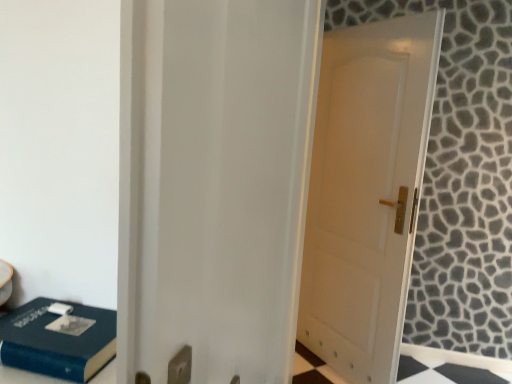
Question: Does blue matte book at lower left turn towards white matte door at center?

Choices:
 (A) no
 (B) yes

Answer: (A)

Question: Does blue matte book at lower left have a larger size compared to white matte door at center?

Choices:
 (A) no
 (B) yes

Answer: (A)

Question: From a real-world perspective, is blue matte book at lower left over white matte door at center?

Choices:
 (A) yes
 (B) no

Answer: (B)

Question: Is white matte door at center located within blue matte book at lower left?

Choices:
 (A) yes
 (B) no

Answer: (B)

Question: From the image's perspective, does blue matte book at lower left appear higher than white matte door at center?

Choices:
 (A) no
 (B) yes

Answer: (A)

Question: Is white matte door at center taller or shorter than blue matte book at lower left?

Choices:
 (A) tall
 (B) short

Answer: (A)

Question: Would you say white matte door at center is to the left or to the right of blue matte book at lower left in the picture?

Choices:
 (A) left
 (B) right

Answer: (B)

Question: Do you think white matte door at center is within blue matte book at lower left, or outside of it?

Choices:
 (A) outside
 (B) inside

Answer: (A)

Question: From a real-world perspective, is white matte door at center physically located above or below blue matte book at lower left?

Choices:
 (A) below
 (B) above

Answer: (B)

Question: In terms of height, does blue matte book at lower left look taller or shorter compared to white matte door at center?

Choices:
 (A) tall
 (B) short

Answer: (B)

Question: From a real-world perspective, is blue matte book at lower left physically located above or below white matte door at center?

Choices:
 (A) below
 (B) above

Answer: (A)

Question: Is point (87, 349) positioned closer to the camera than point (345, 281)?

Choices:
 (A) farther
 (B) closer

Answer: (B)

Question: From the image's perspective, is blue matte book at lower left located above or below white matte door at center?

Choices:
 (A) above
 (B) below

Answer: (B)

Question: In the image, is blue matte book at lower left on the left side or the right side of white glossy door at center?

Choices:
 (A) left
 (B) right

Answer: (A)

Question: Is point (64, 337) closer or farther from the camera than point (266, 86)?

Choices:
 (A) closer
 (B) farther

Answer: (B)